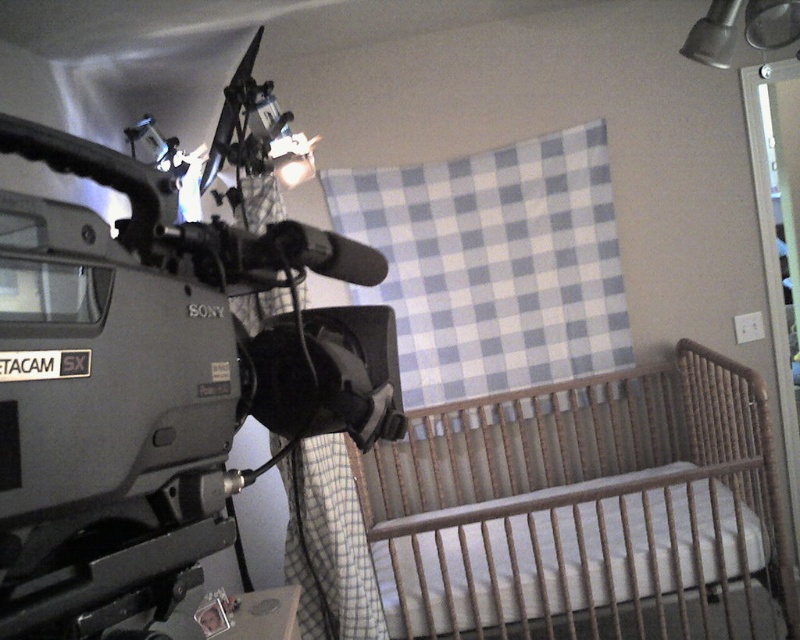
You are setting up a camera for a documentary shoot in the room described. The Sony video camera is mounted on a tripod in the foreground. Where should you position the camera to ensure it captures the wooden crib at lower right clearly in the frame?

The wooden crib at lower right is located at point (586, 512), so positioning the camera to face that coordinate will ensure the crib is clearly visible in the frame.

You are a photographer setting up equipment in this room. You need to place a 1.2 meter tall stand between the metallic gray video camera at left and the wooden changing table at lower center. Will the stand fit vertically between them?

The metallic gray video camera at left is much taller than the wooden changing table at lower center. Since the stand is 1.2 meters tall, it may not fit vertically between them if the space between the two objects is constrained by their height difference. However, without specific distance information, it is difficult to determine definitively.

You are a camera operator setting up for a baby photography session. You need to ensure the metallic gray video camera at left is not blocking the wooden changing table at lower center where the photographer will be working. Is the camera currently positioned in a way that might interfere with their workspace?

The metallic gray video camera at left is positioned over the wooden changing table at lower center, which means it is directly above the workspace. This placement could interfere with the photographer accessing the table, so adjustments are needed to move the camera away from that position.